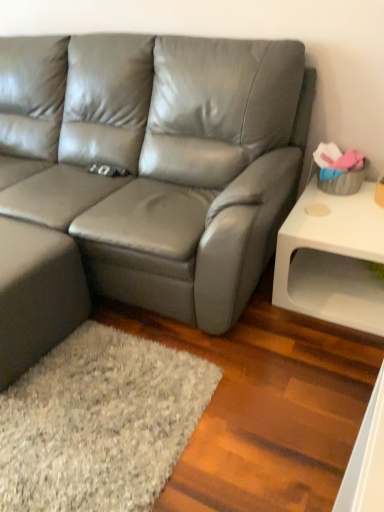
Image resolution: width=384 pixels, height=512 pixels. What are the coordinates of `free space above white matte side table at right (from a real-world perspective)` in the screenshot? It's located at (344, 210).